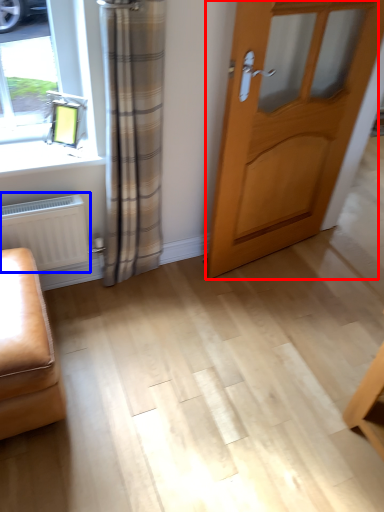
Question: Among these objects, which one is nearest to the camera, door (highlighted by a red box) or radiator (highlighted by a blue box)?

Choices:
 (A) door
 (B) radiator

Answer: (A)